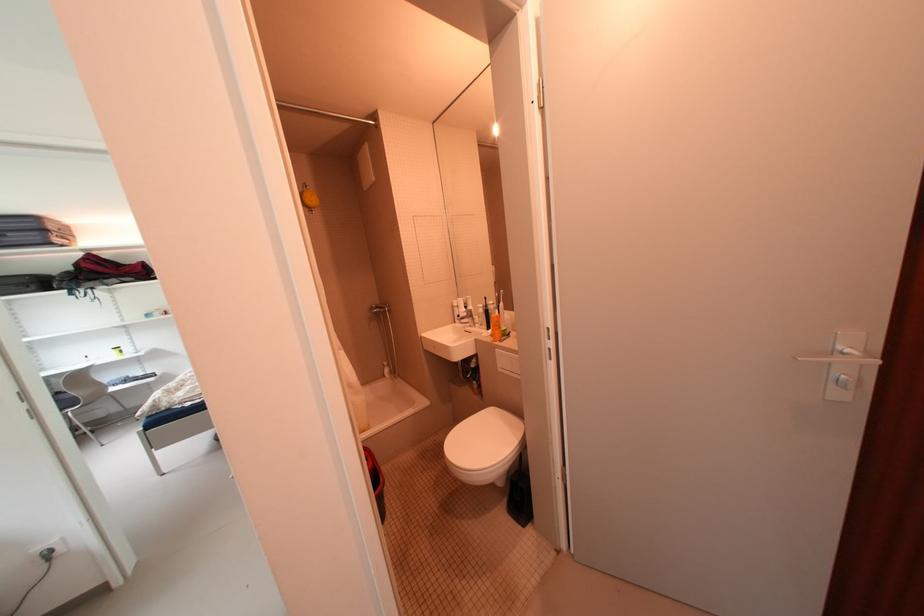
The width and height of the screenshot is (924, 616). What do you see at coordinates (483, 439) in the screenshot?
I see `a white toilet lid` at bounding box center [483, 439].